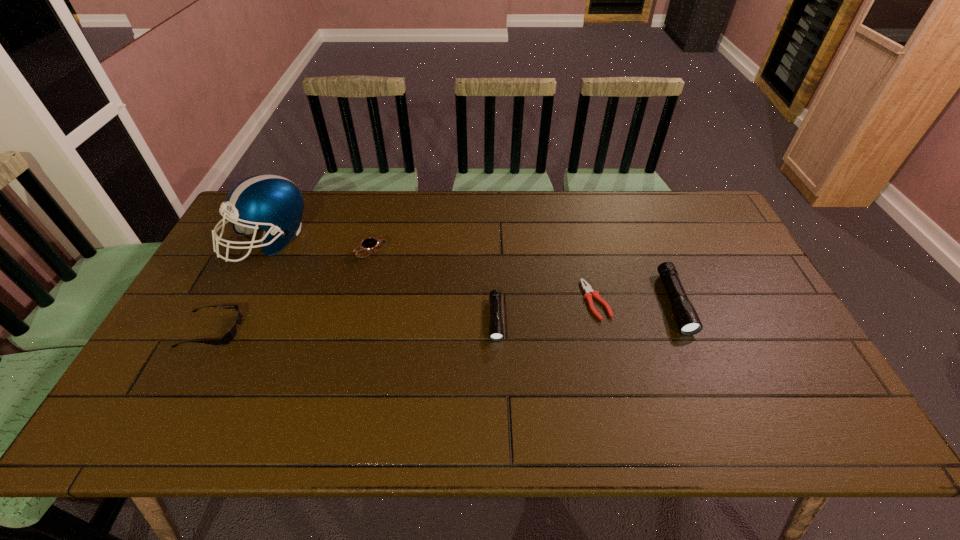
Where is `empty space between the fifth object from left to right and the third object from right to left`? empty space between the fifth object from left to right and the third object from right to left is located at coordinates (546, 309).

The width and height of the screenshot is (960, 540). I want to click on blank region between the shorter flashlight and the sunglasses, so pos(353,325).

Where is `vacant space in between the sunglasses and the football helmet`? This screenshot has width=960, height=540. vacant space in between the sunglasses and the football helmet is located at coordinates (240, 285).

This screenshot has height=540, width=960. I want to click on vacant space that is in between the shortest object and the football helmet, so click(x=432, y=270).

Identify the location of empty space between the right flashlight and the shorter flashlight. The width and height of the screenshot is (960, 540). (585, 311).

Identify which object is the nearest to the rightmost object. Please provide its 2D coordinates. Your answer should be formatted as a tuple, i.e. [(x, y)], where the tuple contains the x and y coordinates of a point satisfying the conditions above.

[(589, 292)]

You are a GUI agent. You are given a task and a screenshot of the screen. Output one action in this format:
    pyautogui.click(x=<x>, y=<y>)
    Task: Click on the object identified as the third closest to the sunglasses
    The width and height of the screenshot is (960, 540).
    Given the screenshot: What is the action you would take?
    pyautogui.click(x=496, y=331)

Locate an element on the screen. The image size is (960, 540). free location that satisfies the following two spatial constraints: 1. at the lens end of the left flashlight; 2. on the front-facing side of the sunglasses is located at coordinates (496, 329).

Identify the location of free space that satisfies the following two spatial constraints: 1. at the front of the tallest object with the faceguard; 2. on the front-facing side of the sunglasses. The image size is (960, 540). (223, 329).

You are a GUI agent. You are given a task and a screenshot of the screen. Output one action in this format:
    pyautogui.click(x=<x>, y=<y>)
    Task: Click on the vacant space that satisfies the following two spatial constraints: 1. at the lens end of the shorter flashlight; 2. on the front-facing side of the sunglasses
    
    Given the screenshot: What is the action you would take?
    pyautogui.click(x=496, y=329)